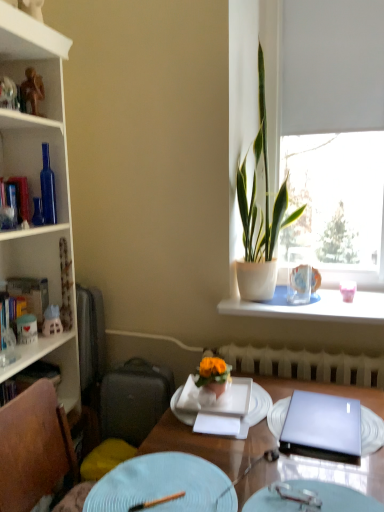
Find the location of a particular element. The width and height of the screenshot is (384, 512). vacant space that is in between wooden chopstick at lower center, the 1th tableware positioned from the bottom, and white paper at center is located at coordinates (192, 462).